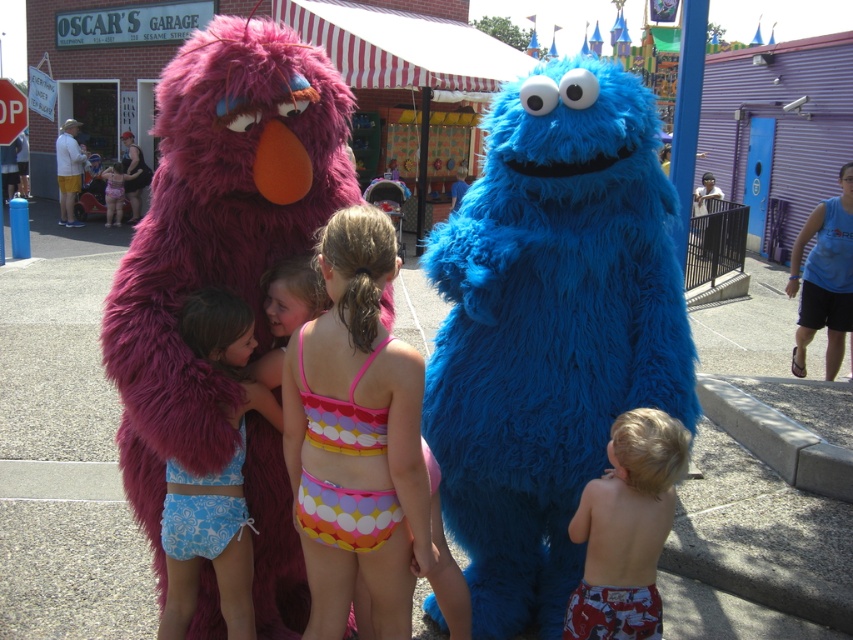
Question: Can you confirm if polka dot bikini at center is wider than printed cotton shorts at lower right?

Choices:
 (A) no
 (B) yes

Answer: (B)

Question: Does polka dot bikini at center have a lesser width compared to red metal stop sign at upper left?

Choices:
 (A) no
 (B) yes

Answer: (B)

Question: Which point appears farthest from the camera in this image?

Choices:
 (A) (589, 611)
 (B) (20, 116)
 (C) (320, 262)

Answer: (B)

Question: Which of these objects is positioned farthest from the red metal stop sign at upper left?

Choices:
 (A) fuzzy purple monster at center
 (B) printed cotton shorts at lower right

Answer: (B)

Question: Among these points, which one is farthest from the camera?

Choices:
 (A) (508, 374)
 (B) (352, 580)

Answer: (A)

Question: Observing the image, what is the correct spatial positioning of fuzzy purple monster at center in reference to red metal stop sign at upper left?

Choices:
 (A) below
 (B) above

Answer: (A)